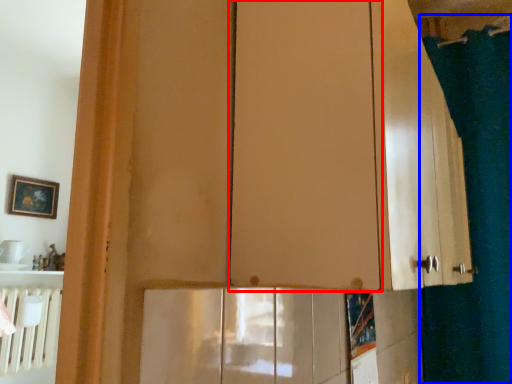
Question: Which object appears farthest to the camera in this image, screen door (highlighted by a red box) or shower curtain (highlighted by a blue box)?

Choices:
 (A) screen door
 (B) shower curtain

Answer: (B)